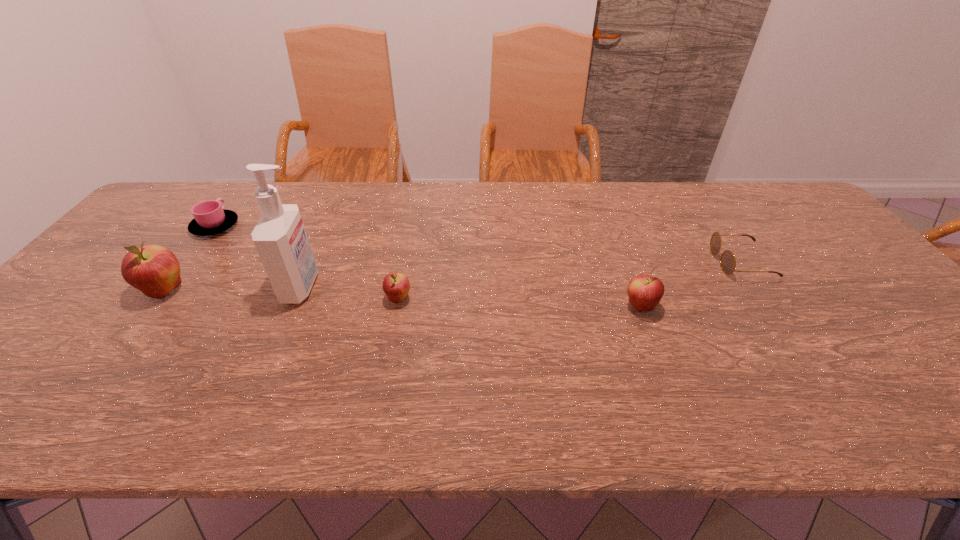
I want to click on object that is at the far edge, so click(x=210, y=218).

You are a GUI agent. You are given a task and a screenshot of the screen. Output one action in this format:
    pyautogui.click(x=<x>, y=<y>)
    Task: Click on the vacant space at the far edge of the desktop
    The width and height of the screenshot is (960, 540).
    Given the screenshot: What is the action you would take?
    pyautogui.click(x=427, y=195)

Where is `free spot at the near edge of the desktop`? The width and height of the screenshot is (960, 540). free spot at the near edge of the desktop is located at coordinates (671, 359).

In the image, there is a desktop. Where is `vacant space at the left edge`? The width and height of the screenshot is (960, 540). vacant space at the left edge is located at coordinates (155, 227).

Image resolution: width=960 pixels, height=540 pixels. I want to click on vacant area at the right edge of the desktop, so click(x=816, y=271).

Identify the location of vacant space at the far left corner of the desktop. This screenshot has width=960, height=540. (169, 208).

The width and height of the screenshot is (960, 540). Find the location of `free space at the far right corner of the desktop`. free space at the far right corner of the desktop is located at coordinates (780, 219).

At what (x,y) coordinates should I click in order to perform the action: click on free space that is in between the cleansing agent and the tallest apple. Please return your answer as a coordinate pair (x, y). Image resolution: width=960 pixels, height=540 pixels. Looking at the image, I should click on (233, 289).

At what (x,y) coordinates should I click in order to perform the action: click on vacant space that's between the sunglasses and the tallest apple. Please return your answer as a coordinate pair (x, y). The image size is (960, 540). Looking at the image, I should click on (453, 276).

The width and height of the screenshot is (960, 540). What are the coordinates of `free space between the third object from left to right and the second apple from right to left` in the screenshot? It's located at (349, 293).